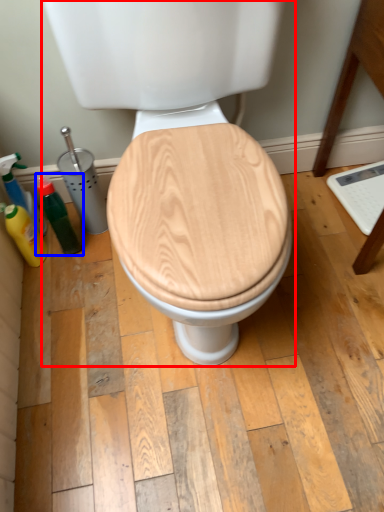
Question: Which object is closer to the camera taking this photo, toilet (highlighted by a red box) or bottle (highlighted by a blue box)?

Choices:
 (A) toilet
 (B) bottle

Answer: (A)